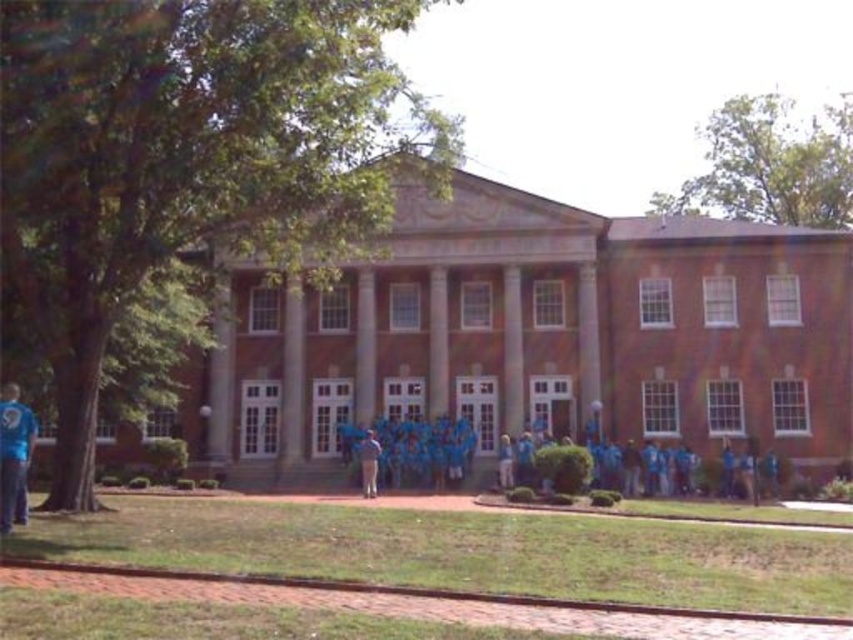
At what (x,y) coordinates should I click in order to perform the action: click on brown brick building at center. Please return your answer as a coordinate pair (x, y). Image resolution: width=853 pixels, height=640 pixels. Looking at the image, I should click on (548, 336).

Between brown brick building at center and smooth stone pillar at center, which one appears on the right side from the viewer's perspective?

smooth stone pillar at center

Identify the location of brown brick building at center. The image size is (853, 640). (548, 336).

The image size is (853, 640). What do you see at coordinates (466, 552) in the screenshot? I see `green grass at lower center` at bounding box center [466, 552].

Locate an element on the screen. The image size is (853, 640). green grass at lower center is located at coordinates (466, 552).

Who is more forward, (798,545) or (218,397)?

Point (798,545) is in front.

This screenshot has height=640, width=853. I want to click on green grass at lower center, so click(x=466, y=552).

Where is `brown brick building at center`? brown brick building at center is located at coordinates (548, 336).

Between point (714, 288) and point (811, 605), which one is positioned in front?

Point (811, 605)

Describe the element at coordinates (548, 336) in the screenshot. I see `brown brick building at center` at that location.

Where is `brown brick building at center`? This screenshot has height=640, width=853. brown brick building at center is located at coordinates (548, 336).